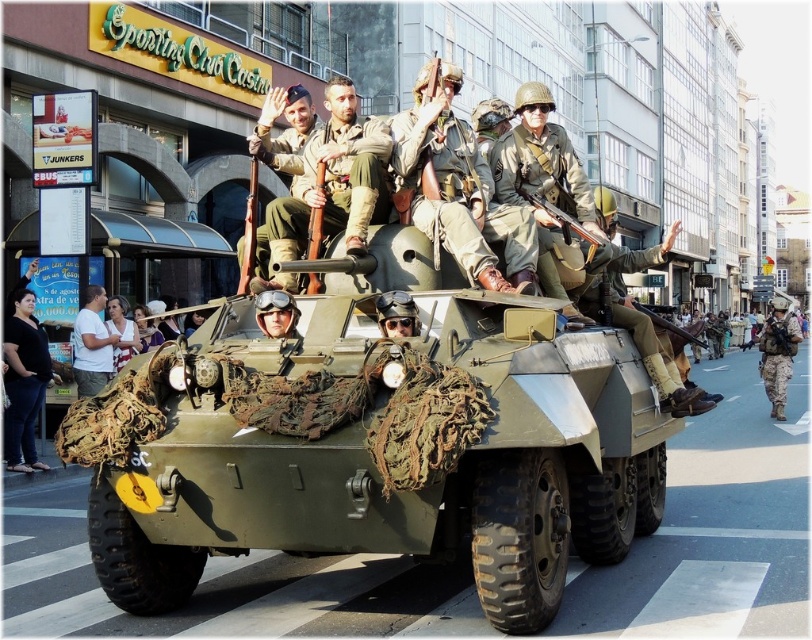
You are a photographer standing at point A, which is at coordinate point A at (433, 97). You want to take a photo of the soldiers on the APC. The camera you have can focus up to 30 feet. Will you be able to capture a clear photo of the soldiers?

The distance between you and the soldiers is 31.50 feet, which exceeds the camera focus range of 30 feet. Therefore, you won t be able to capture a clear photo of the soldiers.